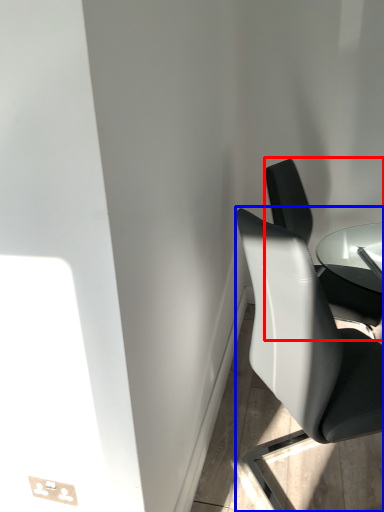
Question: Among these objects, which one is farthest to the camera, chair (highlighted by a red box) or chair (highlighted by a blue box)?

Choices:
 (A) chair
 (B) chair

Answer: (A)